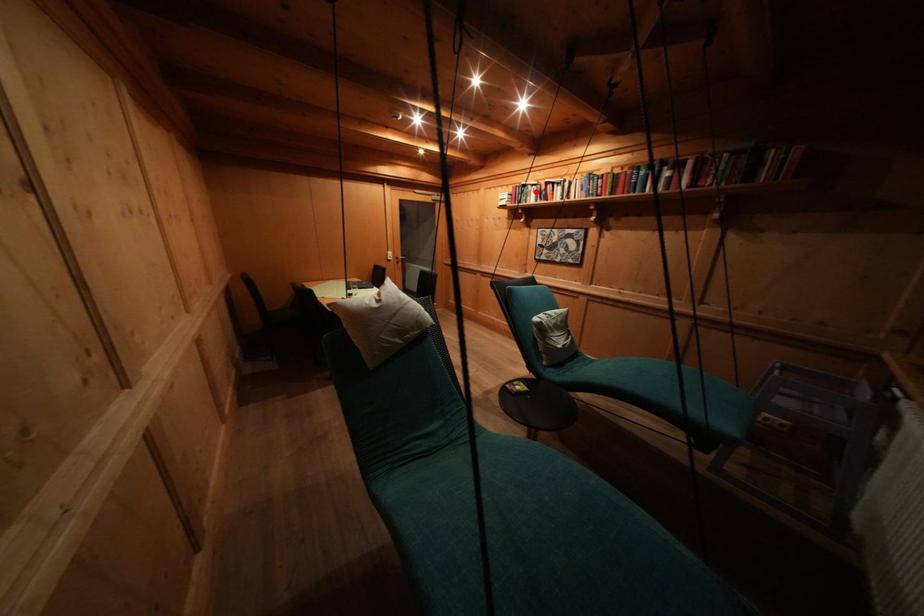
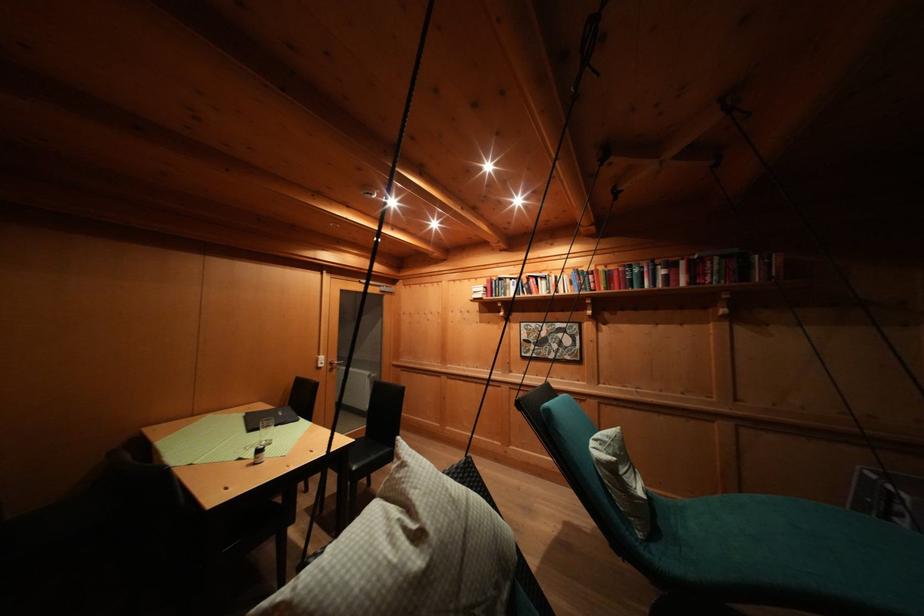
Find the pixel in the second image that matches the highlighted location in the first image.

(514, 285)